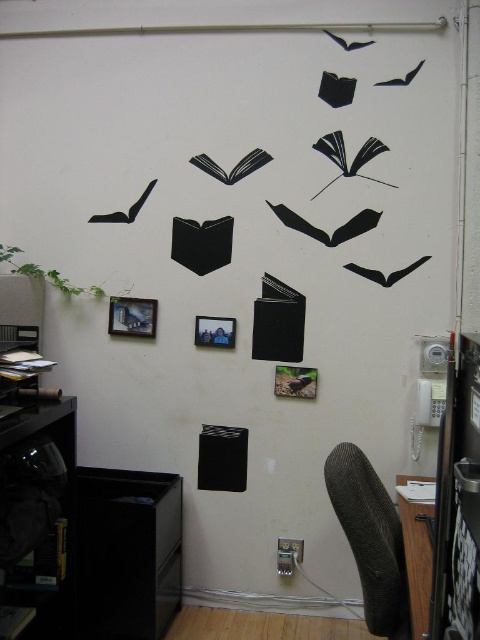
Is point (25, 538) positioned behind point (222, 326)?

That is False.

Which is more to the right, black matte bookshelf at lower left or metallic silver picture frame at center?

From the viewer's perspective, metallic silver picture frame at center appears more on the right side.

Who is more forward, (23, 586) or (228, 340)?

Point (23, 586)

Locate an element on the screen. The width and height of the screenshot is (480, 640). black matte bookshelf at lower left is located at coordinates (36, 508).

Does matte black book at left lie in front of metallic silver picture frame at center?

Yes, matte black book at left is closer to the viewer.

Can you confirm if matte black book at left is smaller than metallic silver picture frame at center?

Actually, matte black book at left might be larger than metallic silver picture frame at center.

I want to click on matte black book at left, so click(x=23, y=364).

This screenshot has width=480, height=640. Identify the location of matte black book at left. (23, 364).

Which is in front, point (412, 636) or point (23, 360)?

Point (412, 636)

Is point (423, 632) closer to camera compared to point (10, 353)?

Yes, it is in front of point (10, 353).

The image size is (480, 640). In order to click on wooden table at lower right in this screenshot , I will do `click(417, 560)`.

What are the coordinates of `wooden table at lower right` in the screenshot? It's located at (417, 560).